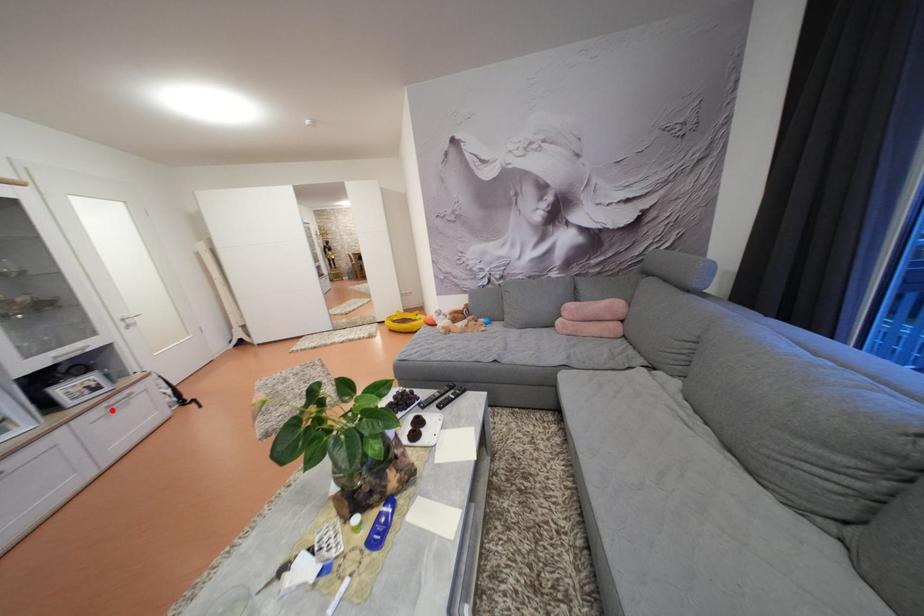
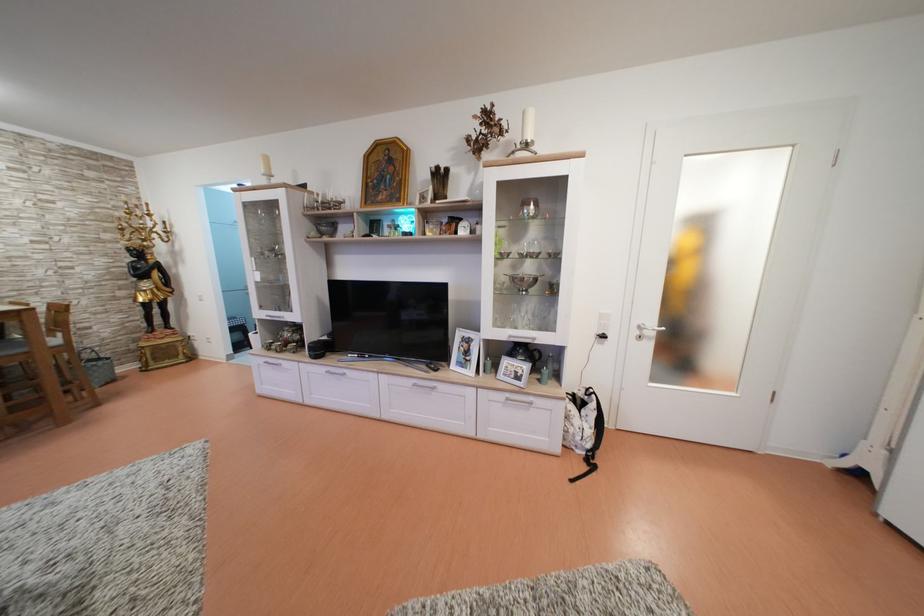
Question: I am providing you with two images of the same scene from different viewpoints. Given a red point in image1, look at the same physical point in image2. Is it:

Choices:
 (A) Closer to the viewpoint
 (B) Farther from the viewpoint

Answer: (B)